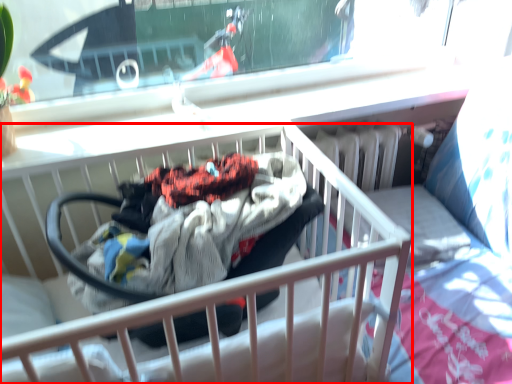
Question: From the image's perspective, where is infant bed (annotated by the red box) located relative to baby carriage?

Choices:
 (A) above
 (B) below

Answer: (B)